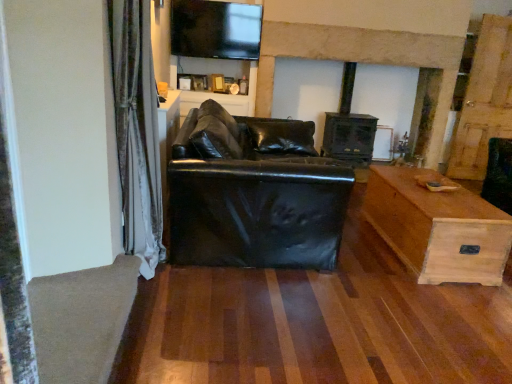
Locate an element on the screen. This screenshot has width=512, height=384. vacant space underneath velvet curtain at left (from a real-world perspective) is located at coordinates (151, 288).